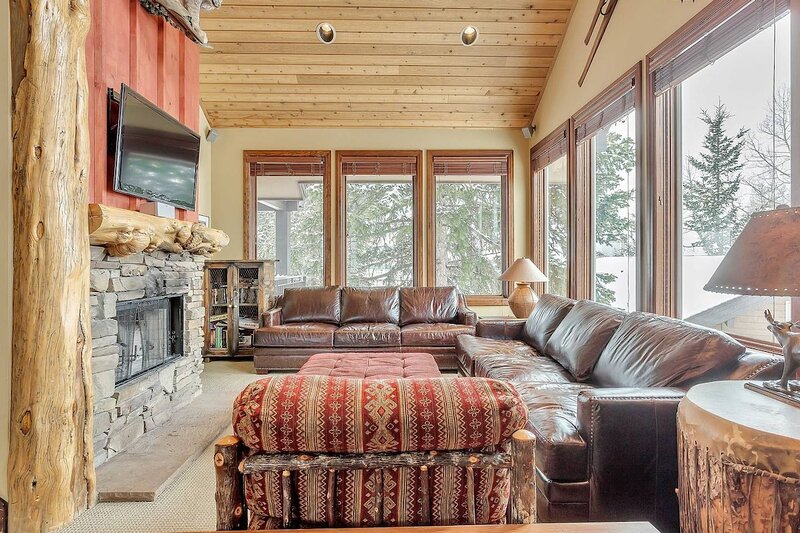
Locate an element on the screen. tv is located at coordinates (134, 149).